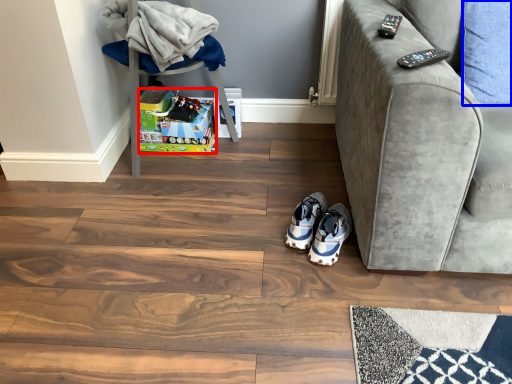
Question: Which of the following is the closest to the observer, toy (highlighted by a red box) or pillow (highlighted by a blue box)?

Choices:
 (A) toy
 (B) pillow

Answer: (B)